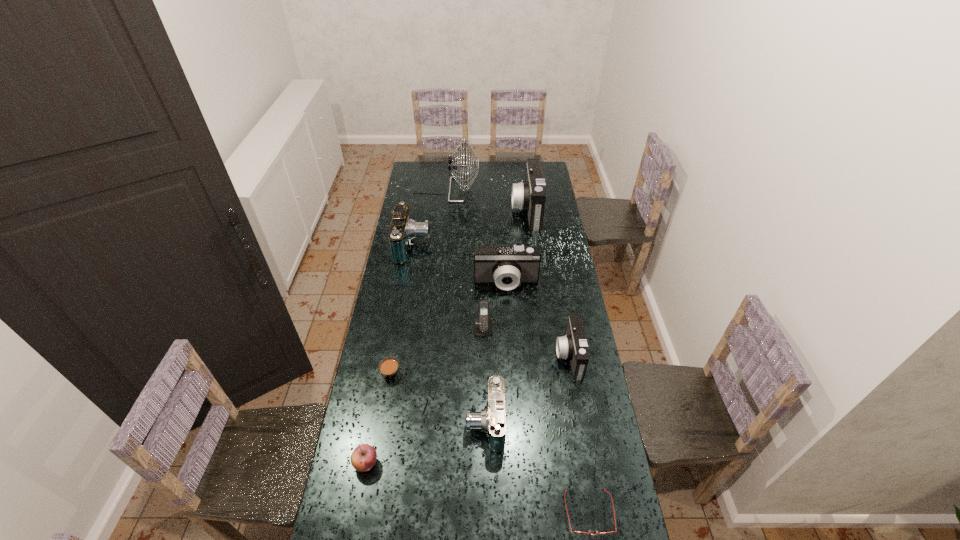
This screenshot has width=960, height=540. Identify the location of the tallest object. (453, 165).

The image size is (960, 540). I want to click on the second tallest object, so click(530, 195).

Locate an element on the screen. the farthest black camcorder is located at coordinates (530, 195).

The image size is (960, 540). In order to click on the fourth farthest object in this screenshot , I will do `click(505, 265)`.

Find the location of `the third nearest camcorder`. the third nearest camcorder is located at coordinates (505, 265).

I want to click on the bigger blue camcorder, so click(x=403, y=229).

This screenshot has width=960, height=540. I want to click on the left blue camcorder, so click(403, 229).

The height and width of the screenshot is (540, 960). Find the location of `cellular telephone`. cellular telephone is located at coordinates (483, 325).

This screenshot has height=540, width=960. I want to click on the nearest black camcorder, so click(x=573, y=346).

This screenshot has height=540, width=960. What are the coordinates of `the smallest black camcorder` in the screenshot? It's located at (573, 346).